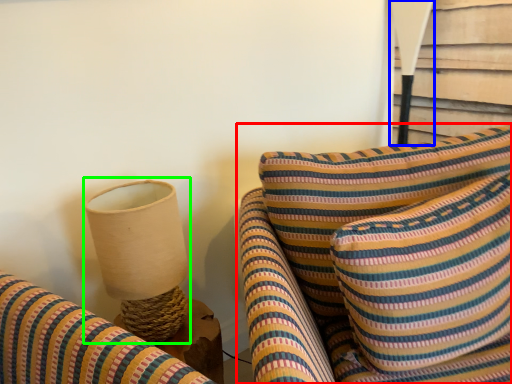
Question: Estimate the real-world distances between objects in this image. Which object is farther from furniture (highlighted by a red box), table lamp (highlighted by a blue box) or table lamp (highlighted by a green box)?

Choices:
 (A) table lamp
 (B) table lamp

Answer: (A)